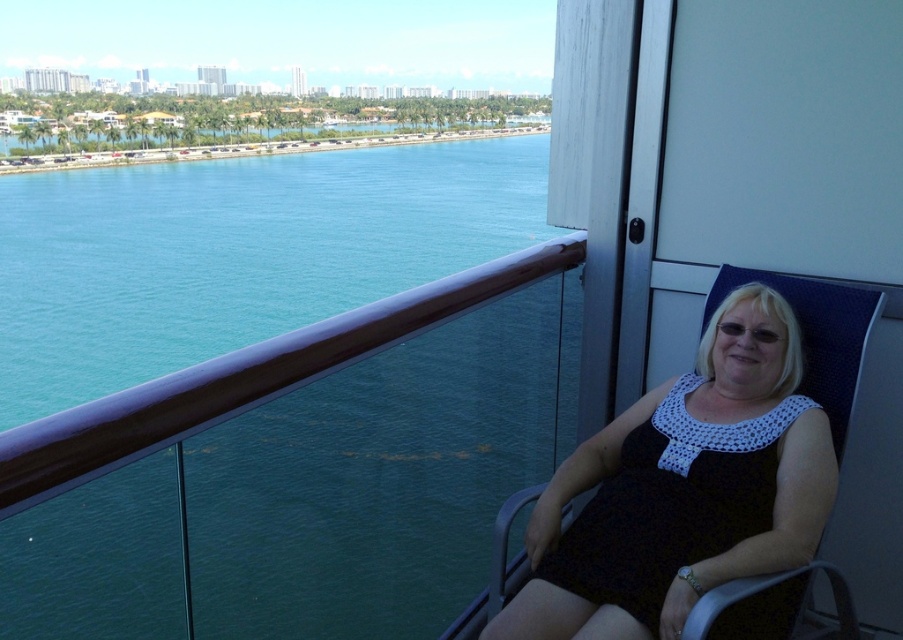
Question: Does teal glossy water at upper left have a lesser width compared to black crochet dress at right?

Choices:
 (A) yes
 (B) no

Answer: (B)

Question: Among these points, which one is nearest to the camera?

Choices:
 (A) (194, 273)
 (B) (714, 493)

Answer: (B)

Question: Is teal glossy water at upper left below black crochet dress at right?

Choices:
 (A) yes
 (B) no

Answer: (B)

Question: Which object is farther from the camera taking this photo?

Choices:
 (A) teal glossy water at upper left
 (B) black crochet dress at right

Answer: (B)

Question: Is teal glossy water at upper left wider than black crochet dress at right?

Choices:
 (A) no
 (B) yes

Answer: (B)

Question: Which point is farther from the camera taking this photo?

Choices:
 (A) (213, 449)
 (B) (738, 628)

Answer: (B)